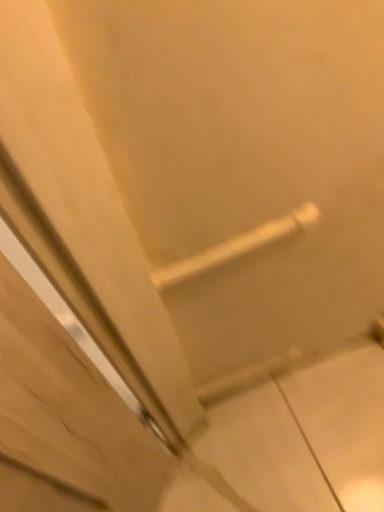
What do you see at coordinates (237, 247) in the screenshot? I see `white matte shower at center` at bounding box center [237, 247].

Identify the location of white matte shower at center. The width and height of the screenshot is (384, 512). (237, 247).

Identify the location of white matte shower at center. (237, 247).